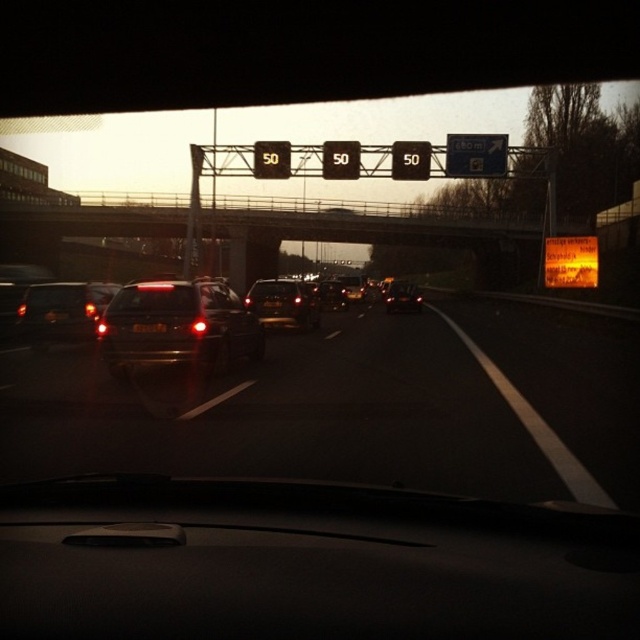
Question: Where is metallic brown speed limit sign at center located in relation to metallic rectangular speed limit sign at center in the image?

Choices:
 (A) below
 (B) above

Answer: (B)

Question: Based on their relative distances, which object is nearer to the matte black car at center?

Choices:
 (A) shiny metallic sedan at center
 (B) shiny metallic car at center
 (C) metallic rectangular sign at center
 (D) black plastic license plate at center

Answer: (D)

Question: Is matte black car at left bigger than blue metallic sign at upper center?

Choices:
 (A) yes
 (B) no

Answer: (B)

Question: Can you confirm if shiny black sedan at center is positioned above black plastic license plate at center?

Choices:
 (A) no
 (B) yes

Answer: (B)

Question: Which point appears farthest from the camera in this image?

Choices:
 (A) (305, 300)
 (B) (426, 163)
 (C) (186, 344)
 (D) (324, 291)

Answer: (B)

Question: Which of these objects is positioned closest to the metallic rectangular speed limit sign at center?

Choices:
 (A) metallic rectangular sign at center
 (B) matte black car at center

Answer: (A)